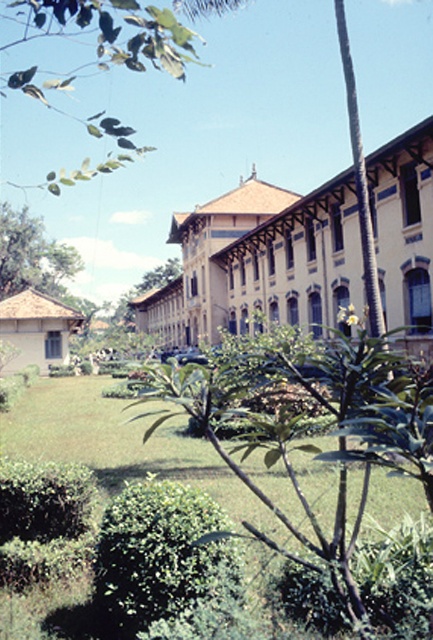
Is beige/wooden palace at center to the right of green grass at lower center from the viewer's perspective?

In fact, beige/wooden palace at center is to the left of green grass at lower center.

Based on the photo, who is positioned more to the left, beige/wooden palace at center or green grass at lower center?

beige/wooden palace at center is more to the left.

Who is more distant from viewer, (206, 257) or (25, 451)?

The point (206, 257) is more distant.

You are a GUI agent. You are given a task and a screenshot of the screen. Output one action in this format:
    pyautogui.click(x=<x>, y=<y>)
    Task: Click on the beige/wooden palace at center
    This screenshot has height=640, width=433.
    Given the screenshot: What is the action you would take?
    pyautogui.click(x=259, y=260)